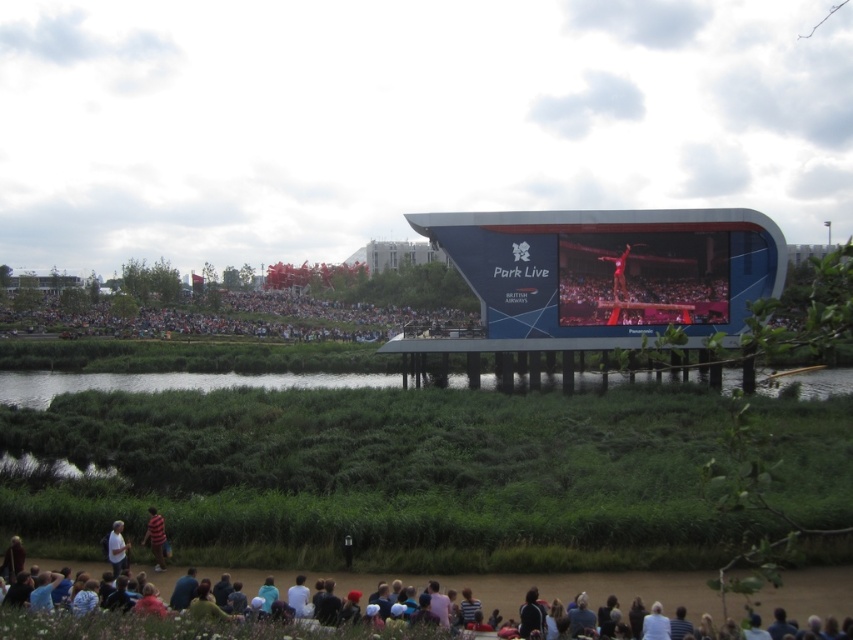
Question: Can you confirm if blue glossy screen at center is smaller than dark gray clothing at lower center?

Choices:
 (A) no
 (B) yes

Answer: (A)

Question: Is dark gray clothing at lower center bigger than striped shirt at lower center?

Choices:
 (A) no
 (B) yes

Answer: (B)

Question: Among these objects, which one is nearest to the camera?

Choices:
 (A) blue glossy screen at center
 (B) striped shirt at lower center

Answer: (B)

Question: Considering the real-world distances, which object is farthest from the red fabric person at center?

Choices:
 (A) blue glossy screen at center
 (B) blue fabric crowd at center
 (C) striped shirt at lower center

Answer: (B)

Question: Is blue glossy screen at center wider than striped shirt at lower center?

Choices:
 (A) yes
 (B) no

Answer: (A)

Question: Which is farther from the striped shirt at lower center?

Choices:
 (A) blue glossy screen at center
 (B) dark gray clothing at lower center
 (C) white fabric shirt at lower left
 (D) blue fabric crowd at center

Answer: (D)